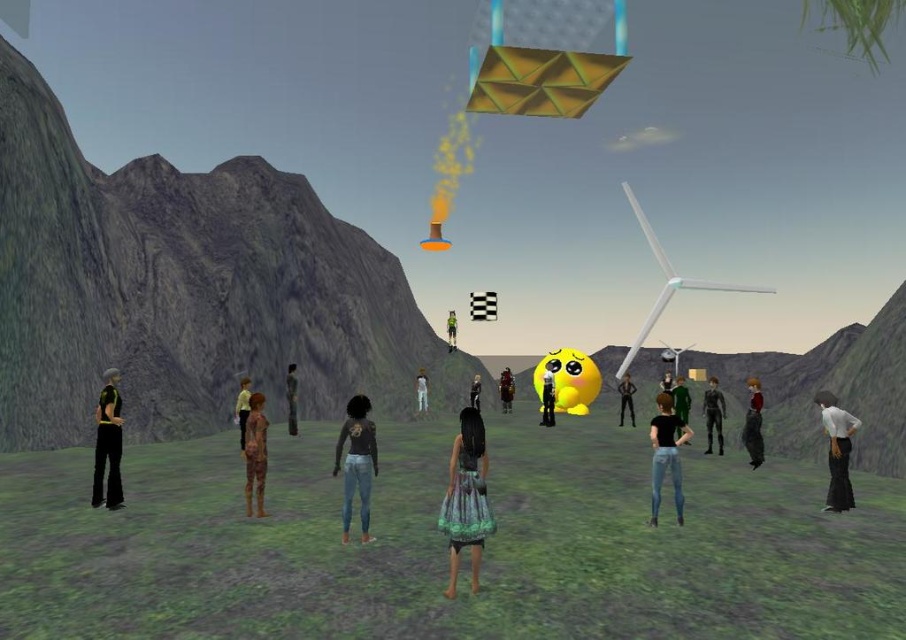
You are an avatar in the scene and want to know which clothing item takes up more horizontal space between the red fabric pants at center right and the green fabric shirt at center. Which one is wider?

The red fabric pants at center right is wider than the green fabric shirt at center.

You are an avatar in the scene. You are wearing a printed fabric dress at center. There is a point marked at coordinate [466,499]. Where is this point located on your printed fabric dress at center?

The point marked at coordinate [466,499] is located on the printed fabric dress at center.